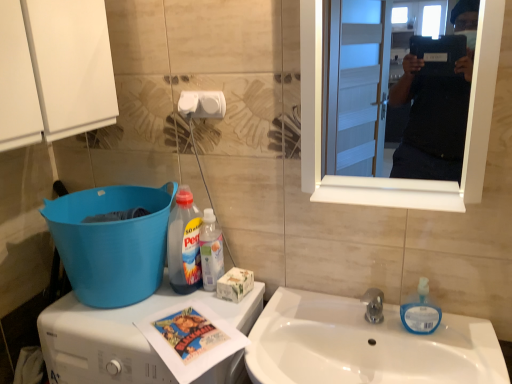
Question: Considering the positions of translucent plastic bottle at center, which appears as the 2th bottle when viewed from the left, and white plastic washing machine at lower left in the image, is translucent plastic bottle at center, which appears as the 2th bottle when viewed from the left, bigger or smaller than white plastic washing machine at lower left?

Choices:
 (A) small
 (B) big

Answer: (A)

Question: From the image's perspective, relative to white plastic washing machine at lower left, is translucent plastic bottle at center, which appears as the 2th bottle when viewed from the left, above or below?

Choices:
 (A) below
 (B) above

Answer: (B)

Question: Based on their relative distances, which object is nearer to the white glossy mirror at upper right?

Choices:
 (A) white plastic washing machine at lower left
 (B) blue plastic bucket at lower left
 (C) white cardboard box at lower center
 (D) blue translucent soap dispenser at sink right
 (E) white matte toilet paper at upper center

Answer: (D)

Question: Considering the real-world distances, which object is closest to the white plastic washing machine at lower left?

Choices:
 (A) white glossy sink at lower center
 (B) white glossy mirror at upper right
 (C) translucent plastic bottle at center, which appears as the 2th bottle when viewed from the left
 (D) blue plastic bucket at lower left
 (E) white matte toilet paper at upper center

Answer: (D)